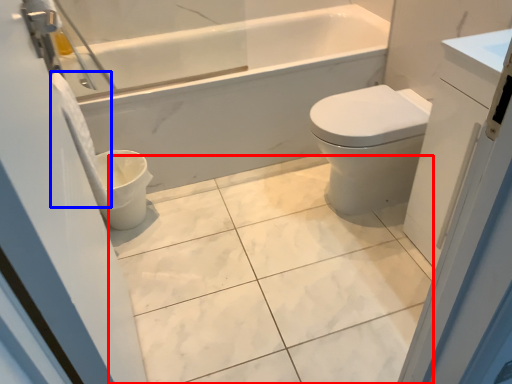
Question: Which object appears closest to the camera in this image, ceramic tile (highlighted by a red box) or toilet paper (highlighted by a blue box)?

Choices:
 (A) ceramic tile
 (B) toilet paper

Answer: (A)